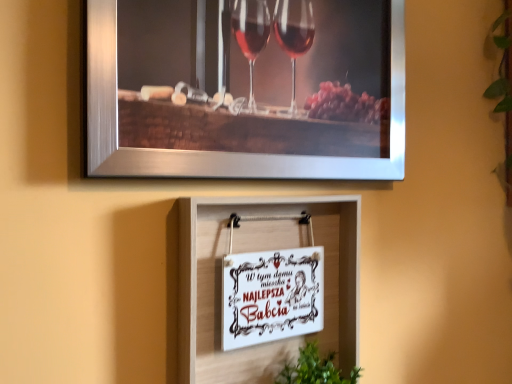
Question: Does green leafy plant at lower center have a larger size compared to white paper sign at center, the 1th picture frame in the bottom-to-top sequence?

Choices:
 (A) yes
 (B) no

Answer: (B)

Question: Does green leafy plant at lower center touch white paper sign at center, the 1th picture frame in the bottom-to-top sequence?

Choices:
 (A) no
 (B) yes

Answer: (A)

Question: From a real-world perspective, is green leafy plant at lower center physically above white paper sign at center, marked as the 3th picture frame in a top-to-bottom arrangement?

Choices:
 (A) no
 (B) yes

Answer: (A)

Question: Is the depth of green leafy plant at lower center greater than that of white paper sign at center, the 1th picture frame in the bottom-to-top sequence?

Choices:
 (A) yes
 (B) no

Answer: (A)

Question: From the image's perspective, is green leafy plant at lower center located above white paper sign at center, marked as the 3th picture frame in a top-to-bottom arrangement?

Choices:
 (A) no
 (B) yes

Answer: (A)

Question: Can you confirm if green leafy plant at lower center is smaller than white paper sign at center, the 1th picture frame in the bottom-to-top sequence?

Choices:
 (A) yes
 (B) no

Answer: (A)

Question: Does green leafy plant at lower center have a greater height compared to white paper sign at center, which is the second picture frame from top to bottom?

Choices:
 (A) no
 (B) yes

Answer: (B)

Question: From the image's perspective, would you say green leafy plant at lower center is shown under white paper sign at center, which appears as the 2th picture frame when ordered from the bottom?

Choices:
 (A) yes
 (B) no

Answer: (A)

Question: Is green leafy plant at lower center thinner than white paper sign at center, which is the second picture frame from top to bottom?

Choices:
 (A) yes
 (B) no

Answer: (B)

Question: Is green leafy plant at lower center positioned in front of white paper sign at center, which appears as the 2th picture frame when ordered from the bottom?

Choices:
 (A) no
 (B) yes

Answer: (A)

Question: Is white paper sign at center, which appears as the 2th picture frame when ordered from the bottom, at the back of green leafy plant at lower center?

Choices:
 (A) yes
 (B) no

Answer: (B)

Question: Is green leafy plant at lower center surrounding white paper sign at center, which is the second picture frame from top to bottom?

Choices:
 (A) yes
 (B) no

Answer: (B)

Question: Considering the relative positions of white paper sign at center, which is the second picture frame from top to bottom, and green leafy plant at lower center in the image provided, is white paper sign at center, which is the second picture frame from top to bottom, to the left of green leafy plant at lower center from the viewer's perspective?

Choices:
 (A) yes
 (B) no

Answer: (A)